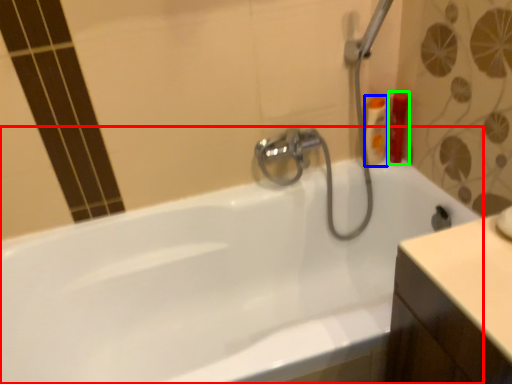
Question: Based on their relative distances, which object is nearer to bathtub (highlighted by a red box)? Choose from toiletry (highlighted by a blue box) and toiletry (highlighted by a green box).

Choices:
 (A) toiletry
 (B) toiletry

Answer: (A)